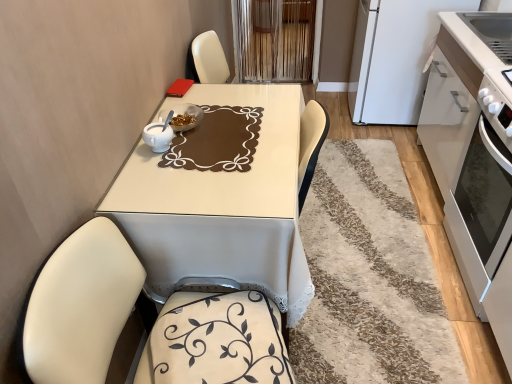
Question: Does white shaggy rug at center turn towards white glossy oven at right?

Choices:
 (A) no
 (B) yes

Answer: (B)

Question: Considering the relative sizes of white shaggy rug at center and white glossy oven at right in the image provided, is white shaggy rug at center shorter than white glossy oven at right?

Choices:
 (A) no
 (B) yes

Answer: (B)

Question: From a real-world perspective, is white shaggy rug at center under white glossy oven at right?

Choices:
 (A) no
 (B) yes

Answer: (B)

Question: Is white shaggy rug at center in front of white glossy oven at right?

Choices:
 (A) yes
 (B) no

Answer: (B)

Question: Does white shaggy rug at center have a smaller size compared to white glossy oven at right?

Choices:
 (A) no
 (B) yes

Answer: (B)

Question: In terms of height, does white matte cabinet at right look taller or shorter compared to white glossy table at center?

Choices:
 (A) tall
 (B) short

Answer: (A)

Question: Is white matte cabinet at right in front of or behind white glossy table at center in the image?

Choices:
 (A) behind
 (B) front

Answer: (A)

Question: Is white matte cabinet at right situated inside white glossy table at center or outside?

Choices:
 (A) inside
 (B) outside

Answer: (B)

Question: In terms of size, does white matte cabinet at right appear bigger or smaller than white glossy table at center?

Choices:
 (A) big
 (B) small

Answer: (B)

Question: From a real-world perspective, relative to white shaggy rug at center, is white glossy table at center vertically above or below?

Choices:
 (A) below
 (B) above

Answer: (B)

Question: Is white glossy table at center spatially inside white shaggy rug at center, or outside of it?

Choices:
 (A) inside
 (B) outside

Answer: (B)

Question: Considering the positions of point (249, 182) and point (320, 360), is point (249, 182) closer or farther from the camera than point (320, 360)?

Choices:
 (A) closer
 (B) farther

Answer: (A)

Question: Is white glossy table at center to the left or to the right of white shaggy rug at center in the image?

Choices:
 (A) right
 (B) left

Answer: (B)

Question: From a real-world perspective, is white matte cabinet at right physically located above or below white matte refrigerator at upper right?

Choices:
 (A) above
 (B) below

Answer: (B)

Question: In the image, is white matte cabinet at right on the left side or the right side of white matte refrigerator at upper right?

Choices:
 (A) right
 (B) left

Answer: (A)